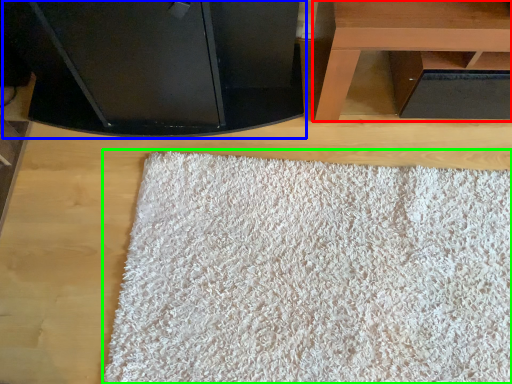
Question: Considering the real-world distances, which object is farthest from table (highlighted by a red box)? furniture (highlighted by a blue box) or mat (highlighted by a green box)?

Choices:
 (A) furniture
 (B) mat

Answer: (B)